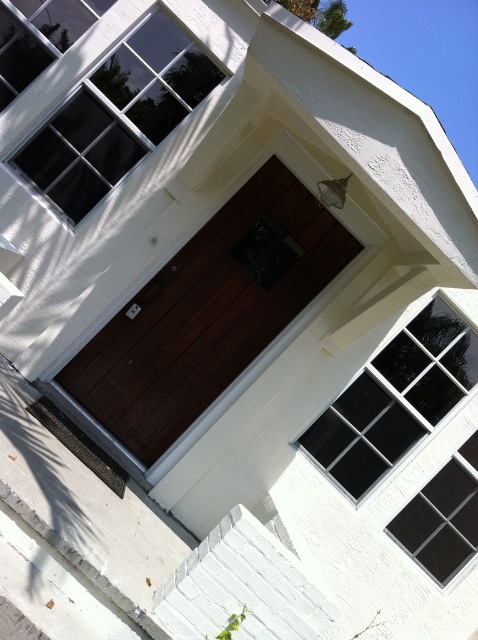
Looking at this image, who is lower down, dark wood door at center or white painted wood stairs at lower center?

Positioned lower is white painted wood stairs at lower center.

Does dark wood door at center have a greater height compared to white painted wood stairs at lower center?

Indeed, dark wood door at center has a greater height compared to white painted wood stairs at lower center.

Where is `dark wood door at center`? This screenshot has width=478, height=640. dark wood door at center is located at coordinates (208, 310).